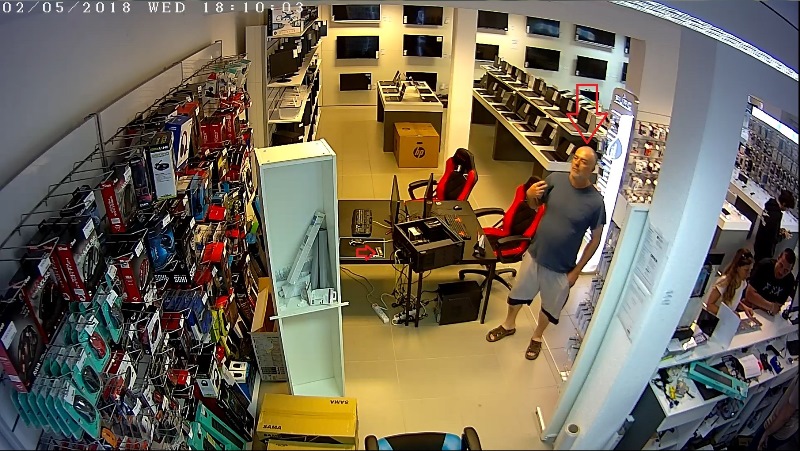
This screenshot has height=451, width=800. I want to click on computer chairs, so click(x=514, y=221), click(x=454, y=183), click(x=434, y=439).